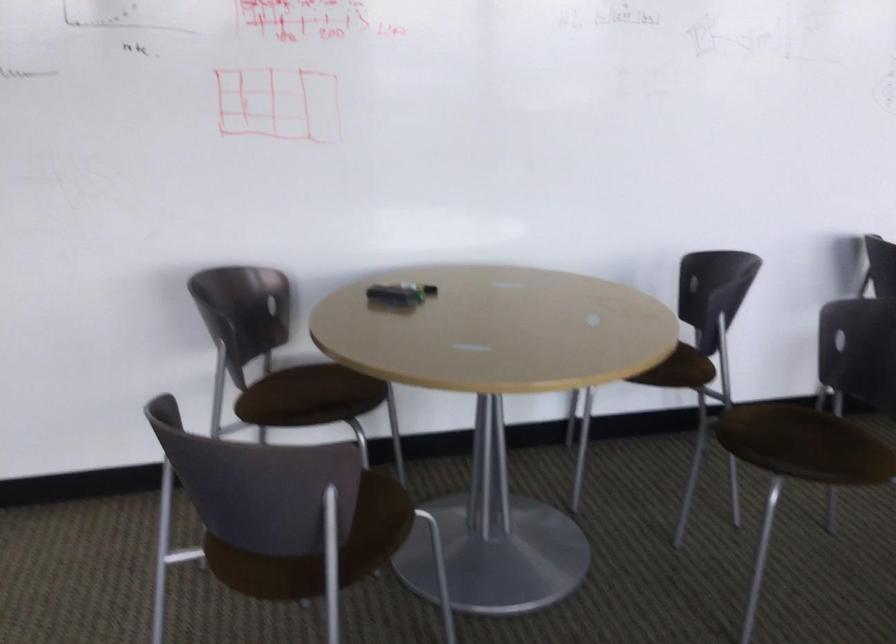
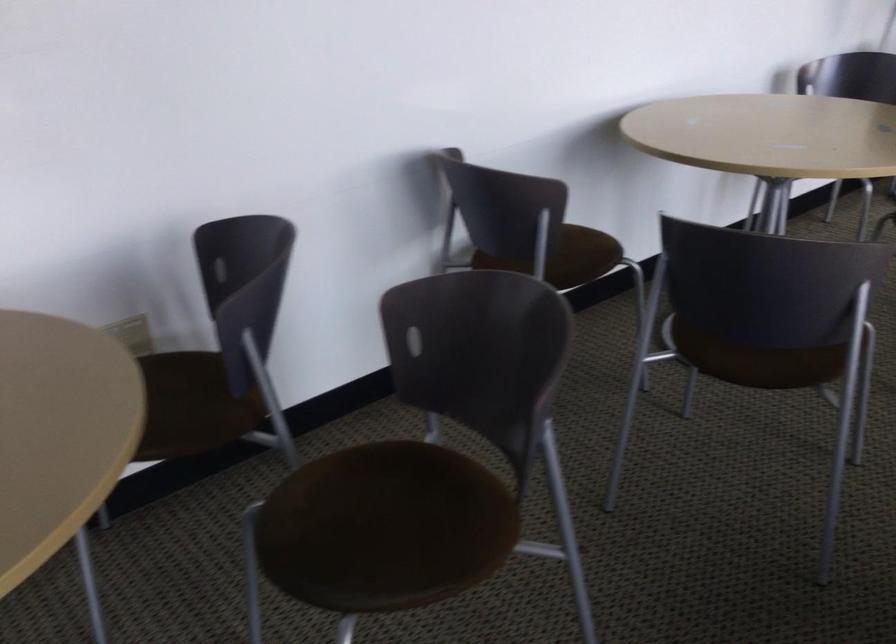
Question: Based on the continuous images, in which direction is the camera rotating? Reply with the corresponding letter.

Choices:
 (A) Left
 (B) Right
 (C) Up
 (D) Down

Answer: (B)